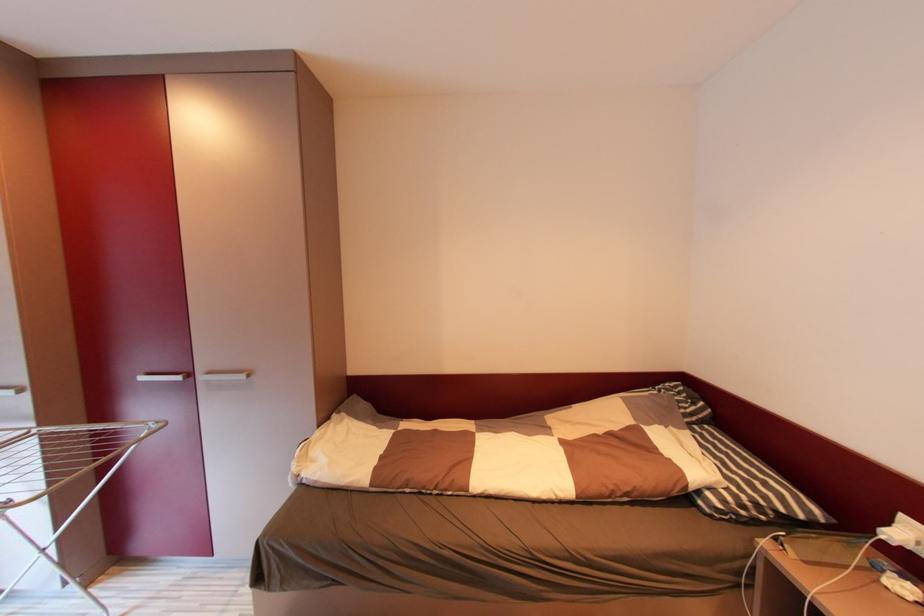
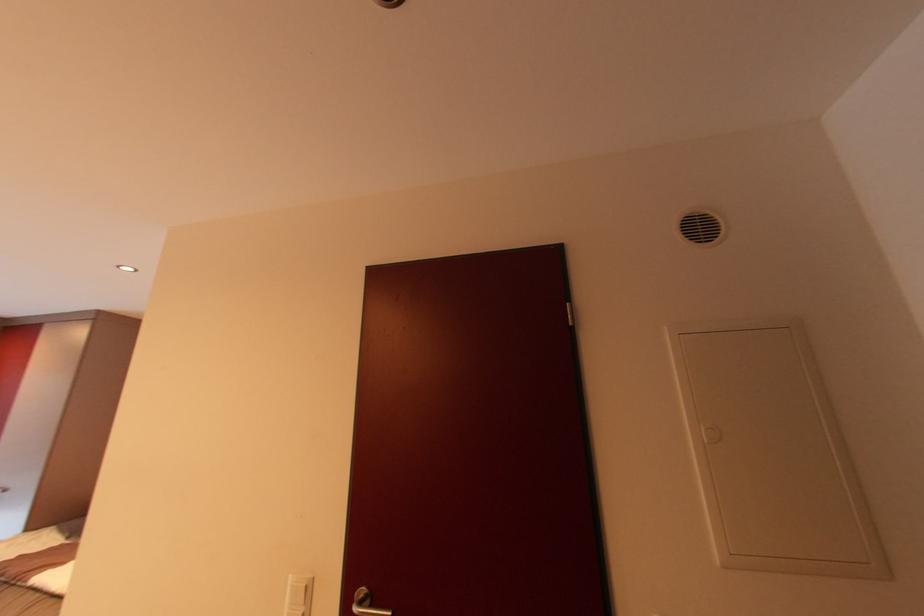
Question: What movement of the cameraman would produce the second image?

Choices:
 (A) Left
 (B) Right
 (C) Forward
 (D) Backward

Answer: (B)